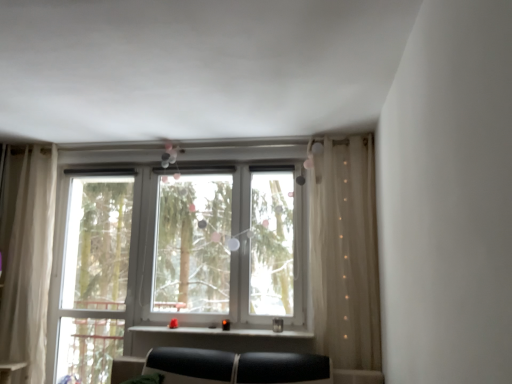
Question: Relative to white plastic bay window at center, is matte black window sill at center in front or behind?

Choices:
 (A) front
 (B) behind

Answer: (A)

Question: From a real-world perspective, is matte black window sill at center above or below white plastic bay window at center?

Choices:
 (A) above
 (B) below

Answer: (B)

Question: Estimate the real-world distances between objects in this image. Which object is farther from the sheer beige curtain at right, which is the 1th curtain from right to left?

Choices:
 (A) sheer white curtain at left, the 1th curtain positioned from the left
 (B) matte black window sill at center
 (C) white plastic bay window at center
 (D) clear glass window at left

Answer: (A)

Question: Based on their relative distances, which object is nearer to the sheer beige curtain at right, which is the 1th curtain from right to left?

Choices:
 (A) white plastic bay window at center
 (B) sheer white curtain at left, the 1th curtain positioned from the left
 (C) matte black window sill at center
 (D) clear glass window at left

Answer: (A)